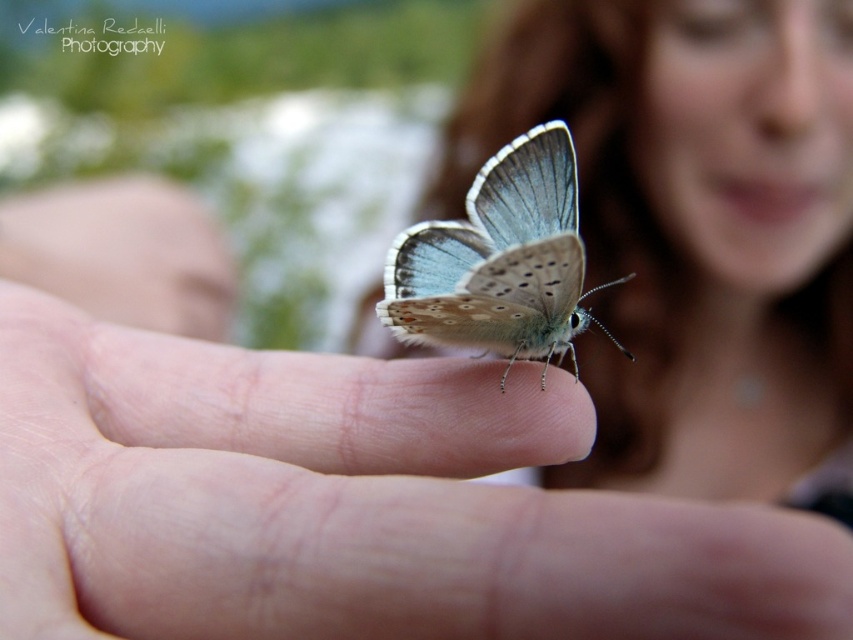
In the scene shown: You are a photographer trying to capture a closeup of the butterfly on the finger. The camera you are using has a focal length of 100mm. To ensure both the butterfly on the smooth skin finger at center and the smooth skin face at upper center are in focus, what should you adjust on your camera?

The smooth skin finger at center is 87.33 centimeters from the smooth skin face at upper center. To ensure both are in focus, adjust the aperture to a smaller opening, increasing the depth of field, allowing both the butterfly on the smooth skin finger at center and the smooth skin face at upper center to be sharp.

You are a photographer trying to capture the butterfly on the finger. You need to position your camera so that the smooth skin face at upper center is in focus. What are the coordinates where you should aim your camera?

The smooth skin face at upper center is located at coordinates point [686,234], so you should aim your camera at those coordinates to ensure it is in focus.

You are a photographer trying to capture the butterfly on the finger. You need to ensure both the smooth skin face at upper center and the translucent blue wings at center are clearly visible in the photo. Given their size difference, which object should you focus on to ensure clarity?

The smooth skin face at upper center is larger in size than the translucent blue wings at center, so focusing on the smooth skin face at upper center will ensure both are in focus since it is the larger object.